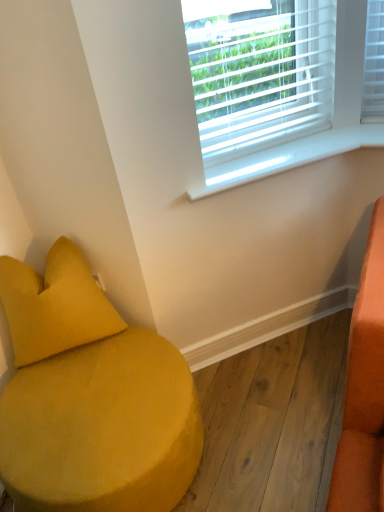
Question: Considering the relative sizes of white plastic window sill at upper center and white plastic blinds at upper center in the image provided, is white plastic window sill at upper center thinner than white plastic blinds at upper center?

Choices:
 (A) no
 (B) yes

Answer: (A)

Question: Can you confirm if white plastic window sill at upper center is positioned to the right of white plastic blinds at upper center?

Choices:
 (A) yes
 (B) no

Answer: (A)

Question: Does white plastic window sill at upper center have a greater height compared to white plastic blinds at upper center?

Choices:
 (A) yes
 (B) no

Answer: (B)

Question: From a real-world perspective, does white plastic window sill at upper center stand above white plastic blinds at upper center?

Choices:
 (A) no
 (B) yes

Answer: (A)

Question: From the image's perspective, is white plastic window sill at upper center over white plastic blinds at upper center?

Choices:
 (A) no
 (B) yes

Answer: (A)

Question: From a real-world perspective, is white plastic window sill at upper center beneath white plastic blinds at upper center?

Choices:
 (A) no
 (B) yes

Answer: (B)

Question: Is white plastic blinds at upper center further to the viewer compared to white plastic window sill at upper center?

Choices:
 (A) yes
 (B) no

Answer: (B)

Question: From a real-world perspective, is white plastic blinds at upper center located higher than white plastic window sill at upper center?

Choices:
 (A) no
 (B) yes

Answer: (B)

Question: Can you confirm if white plastic blinds at upper center is thinner than white plastic window sill at upper center?

Choices:
 (A) yes
 (B) no

Answer: (A)

Question: Is white plastic blinds at upper center at the right side of white plastic window sill at upper center?

Choices:
 (A) yes
 (B) no

Answer: (B)

Question: Does white plastic blinds at upper center have a larger size compared to white plastic window sill at upper center?

Choices:
 (A) yes
 (B) no

Answer: (A)

Question: From the image's perspective, is white plastic blinds at upper center beneath white plastic window sill at upper center?

Choices:
 (A) yes
 (B) no

Answer: (B)

Question: Considering the relative sizes of velvet yellow ottoman at lower left and white plastic window sill at upper center in the image provided, is velvet yellow ottoman at lower left shorter than white plastic window sill at upper center?

Choices:
 (A) yes
 (B) no

Answer: (B)